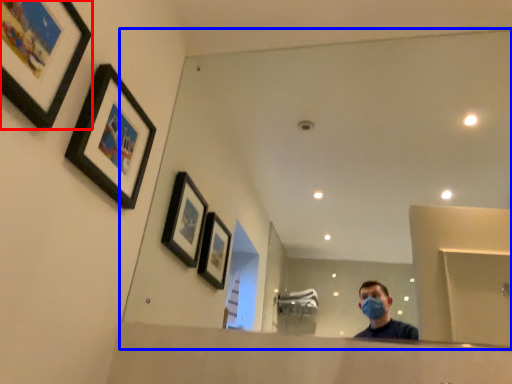
Question: Which object appears farthest to the camera in this image, picture frame (highlighted by a red box) or mirror (highlighted by a blue box)?

Choices:
 (A) picture frame
 (B) mirror

Answer: (B)